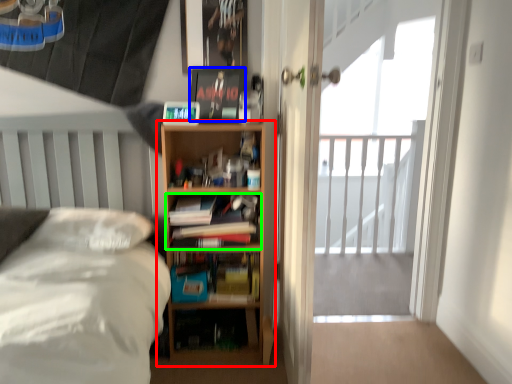
Question: Based on their relative distances, which object is farther from bookcase (highlighted by a red box)? Choose from paperback book (highlighted by a blue box) and book (highlighted by a green box).

Choices:
 (A) paperback book
 (B) book

Answer: (A)